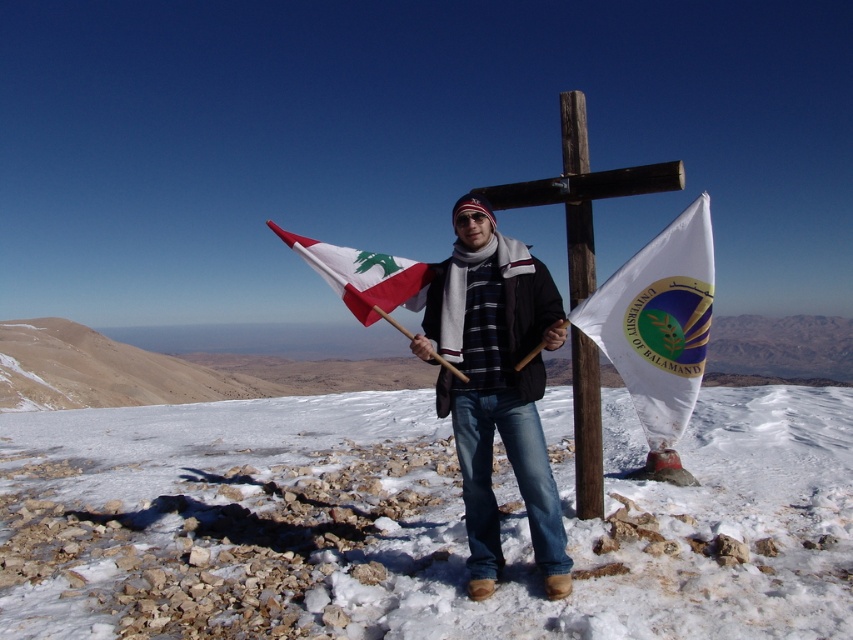
Which is above, wooden at center or wooden pole at center?

Positioned higher is wooden at center.

At what (x,y) coordinates should I click in order to perform the action: click on wooden at center. Please return your answer as a coordinate pair (x, y). Looking at the image, I should click on (582, 192).

This screenshot has height=640, width=853. What are the coordinates of `wooden at center` in the screenshot? It's located at (582, 192).

Can you confirm if white fabric flag at right is smaller than white fabric flag at center?

Incorrect, white fabric flag at right is not smaller in size than white fabric flag at center.

I want to click on white fabric flag at right, so click(659, 323).

Between dark blue jeans at center and white fabric flag at right, which one has more height?

dark blue jeans at center

Can you confirm if dark blue jeans at center is shorter than white fabric flag at right?

No, dark blue jeans at center is not shorter than white fabric flag at right.

Measure the distance between dark blue jeans at center and camera.

They are 3.43 meters apart.

The width and height of the screenshot is (853, 640). Identify the location of dark blue jeans at center. (496, 385).